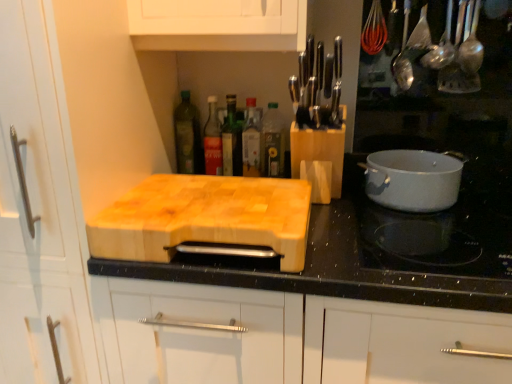
Question: Is natural wood cutting board at center wider than green glass bottle at upper center, arranged as the 5th bottle when viewed from the right?

Choices:
 (A) yes
 (B) no

Answer: (A)

Question: Is natural wood cutting board at center shorter than green glass bottle at upper center, arranged as the 5th bottle when viewed from the right?

Choices:
 (A) yes
 (B) no

Answer: (A)

Question: Is natural wood cutting board at center positioned before green glass bottle at upper center, which is the first bottle from left to right?

Choices:
 (A) yes
 (B) no

Answer: (A)

Question: Does natural wood cutting board at center turn towards green glass bottle at upper center, arranged as the 5th bottle when viewed from the right?

Choices:
 (A) no
 (B) yes

Answer: (A)

Question: Is natural wood cutting board at center at the right side of green glass bottle at upper center, arranged as the 5th bottle when viewed from the right?

Choices:
 (A) no
 (B) yes

Answer: (B)

Question: From a real-world perspective, is green glass bottle at center, which is the third bottle in left-to-right order, physically located above or below natural wood cutting board at center?

Choices:
 (A) below
 (B) above

Answer: (B)

Question: Looking at the image, does green glass bottle at center, arranged as the 3th bottle when viewed from the right, seem bigger or smaller compared to natural wood cutting board at center?

Choices:
 (A) big
 (B) small

Answer: (B)

Question: Would you say green glass bottle at center, arranged as the 3th bottle when viewed from the right, is to the left or to the right of natural wood cutting board at center in the picture?

Choices:
 (A) right
 (B) left

Answer: (A)

Question: Choose the correct answer: Is green glass bottle at center, which is the third bottle in left-to-right order, inside natural wood cutting board at center or outside it?

Choices:
 (A) outside
 (B) inside

Answer: (A)

Question: From the image's perspective, relative to natural wood cutting board at center, is green glass bottle at center, arranged as the 3th bottle when viewed from the right, above or below?

Choices:
 (A) below
 (B) above

Answer: (B)

Question: From a real-world perspective, is green glass bottle at center, arranged as the 3th bottle when viewed from the right, positioned above or below natural wood cutting board at center?

Choices:
 (A) below
 (B) above

Answer: (B)

Question: Would you say green glass bottle at center, arranged as the 3th bottle when viewed from the right, is inside or outside natural wood cutting board at center?

Choices:
 (A) outside
 (B) inside

Answer: (A)

Question: Based on their positions, is green glass bottle at center, arranged as the 3th bottle when viewed from the right, located to the left or right of natural wood cutting board at center?

Choices:
 (A) right
 (B) left

Answer: (A)

Question: In the image, is natural wood cutting board at center positioned in front of or behind wooden cutting board at center?

Choices:
 (A) behind
 (B) front

Answer: (A)

Question: From a real-world perspective, relative to wooden cutting board at center, is natural wood cutting board at center vertically above or below?

Choices:
 (A) below
 (B) above

Answer: (B)